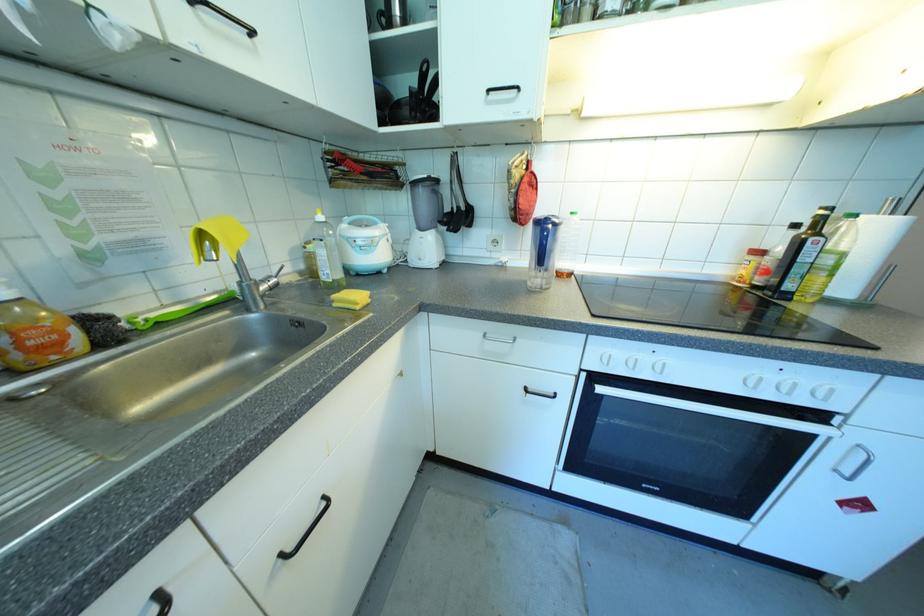
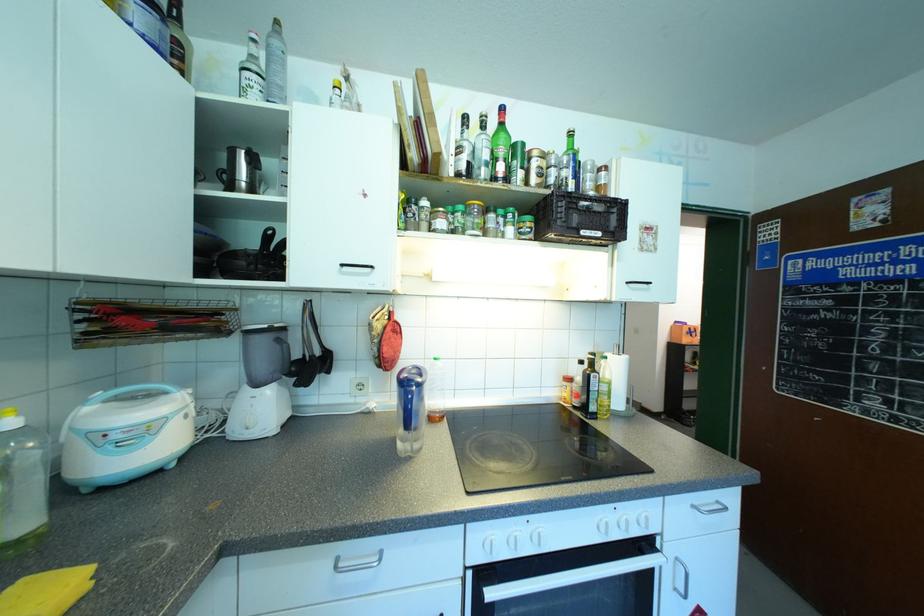
Locate, in the second image, the point that corresponds to (320,217) in the first image.

(8, 422)